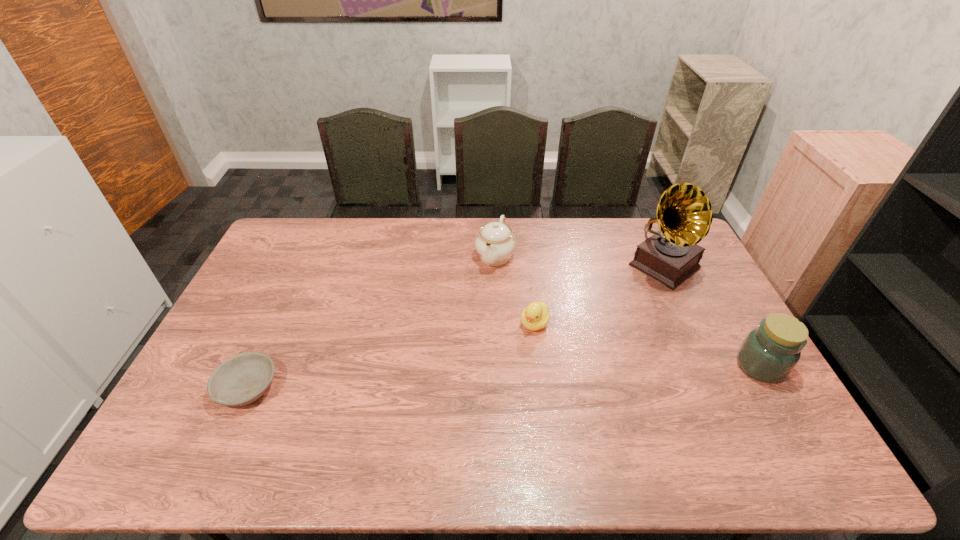
Find the location of a particular element. free spot on the desktop that is between the shortest object and the jar and is positioned at the spout of the chinaware is located at coordinates (442, 380).

Where is `free space on the desktop that is between the shortest object and the jar and is positioned on the beak of the second shortest object`? free space on the desktop that is between the shortest object and the jar and is positioned on the beak of the second shortest object is located at coordinates (497, 377).

Find the location of a particular element. free spot on the desktop that is between the leftmost object and the jar and is positioned from the horn of the phonograph record is located at coordinates (521, 376).